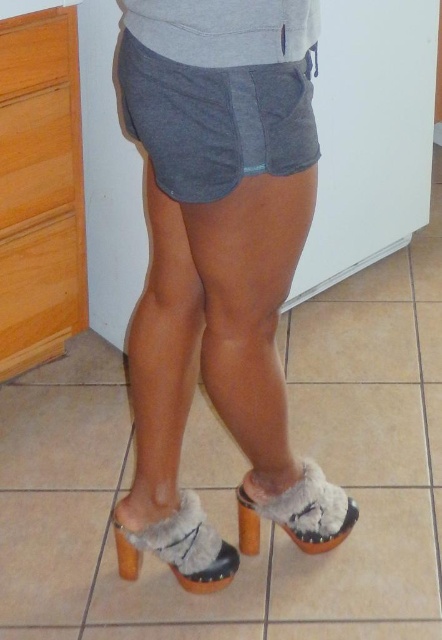
Does gray cotton shorts at center have a lesser width compared to fuzzy fabric heel at lower center?

Incorrect, gray cotton shorts at center's width is not less than fuzzy fabric heel at lower center's.

Is gray cotton shorts at center above fuzzy fabric heel at lower center?

Yes, gray cotton shorts at center is above fuzzy fabric heel at lower center.

Is point (181, 70) positioned before point (122, 548)?

Yes, it is.

What are the coordinates of `gray cotton shorts at center` in the screenshot? It's located at (216, 120).

Can you confirm if gray cotton shorts at center is bigger than fuzzy fabric clog at lower center?

Yes.

What do you see at coordinates (216, 120) in the screenshot?
I see `gray cotton shorts at center` at bounding box center [216, 120].

Where is `gray cotton shorts at center`? gray cotton shorts at center is located at coordinates (216, 120).

Who is more distant from viewer, (186, 531) or (324, 476)?

Point (324, 476)

Can you confirm if fuzzy suede clog at lower center is smaller than fuzzy fabric clog at lower center?

Yes.

Describe the element at coordinates (179, 547) in the screenshot. This screenshot has width=442, height=640. I see `fuzzy suede clog at lower center` at that location.

The image size is (442, 640). Identify the location of fuzzy suede clog at lower center. (179, 547).